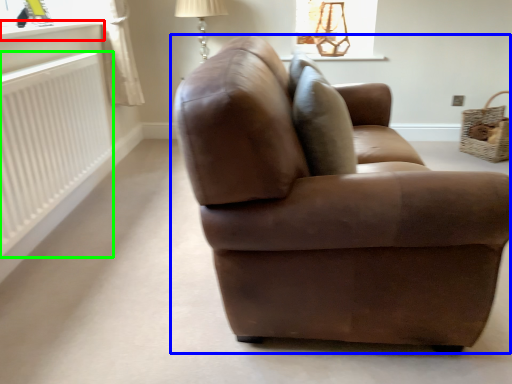
Question: Based on their relative distances, which object is farther from window sill (highlighted by a red box)? Choose from studio couch (highlighted by a blue box) and radiator (highlighted by a green box).

Choices:
 (A) studio couch
 (B) radiator

Answer: (A)